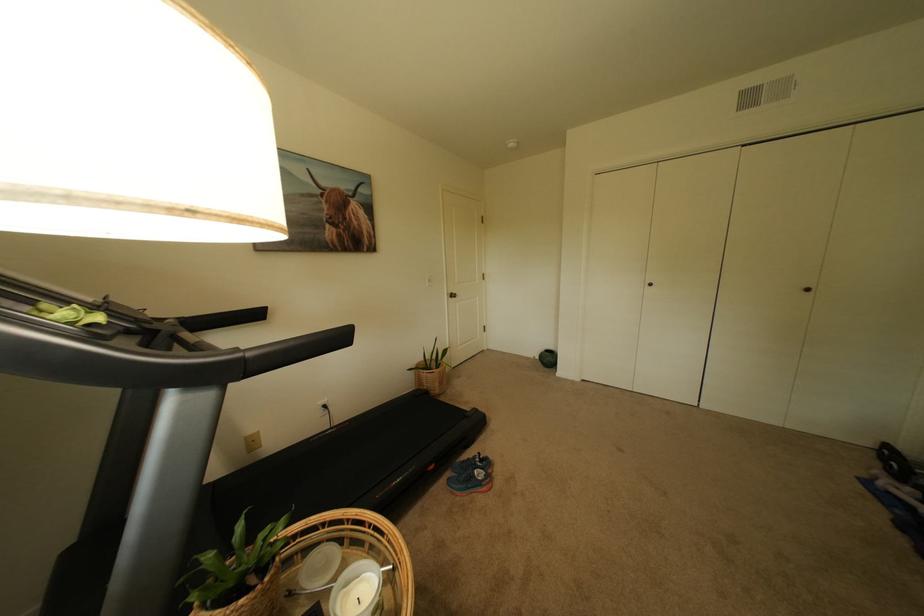
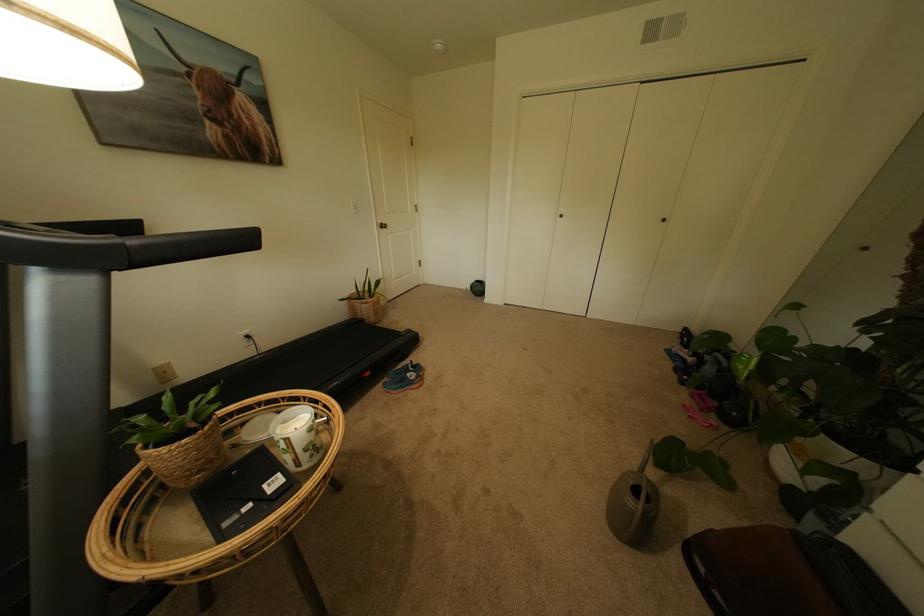
Locate, in the second image, the point that corresponds to (x=251, y=360) in the first image.

(131, 246)